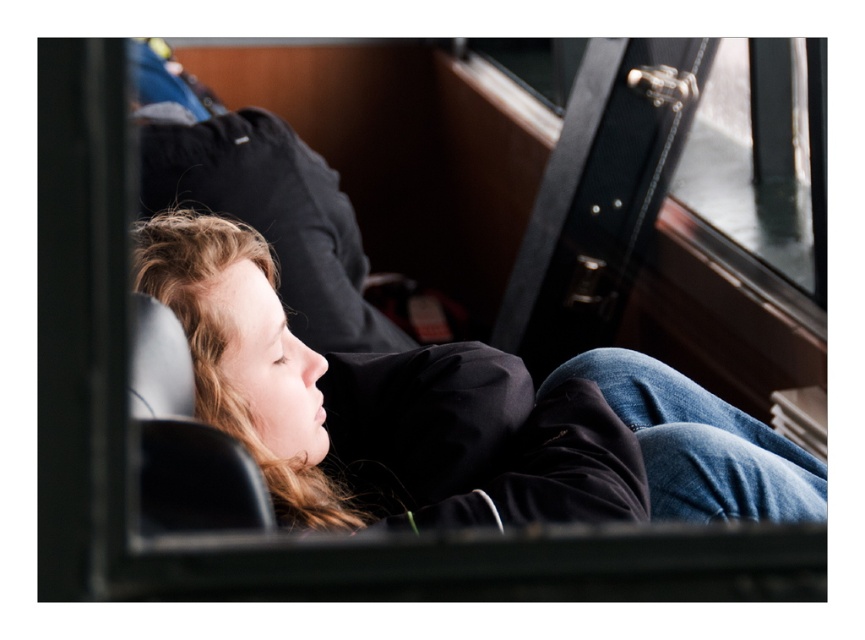
You are a passenger on a train and want to know if your matte black jacket at center is currently under the black leather window at upper right. Can you confirm this?

Yes, the matte black jacket at center is positioned under the black leather window at upper right.

You are standing at the entrance of the train carriage and want to find the matte black jacket at center. According to the coordinates provided, where should you look relative to your position?

The matte black jacket at center is located at point coordinates 0.650 on the x axis and 0.525 on the y axis, so you should look towards the right and slightly forward from your position at the entrance.

You are a passenger trying to find a spot to place your 1.2 meter wide luggage. You see the matte black jacket at center and the black leather chair at left. Which object has enough space to accommodate your luggage?

The matte black jacket at center has a width larger than the black leather chair at left. Since the luggage is 1.2 meters wide, the matte black jacket at center may provide sufficient space if its width exceeds 1.2 meters. However, without knowing the exact dimensions, it is safer to assume the larger object has better chances.